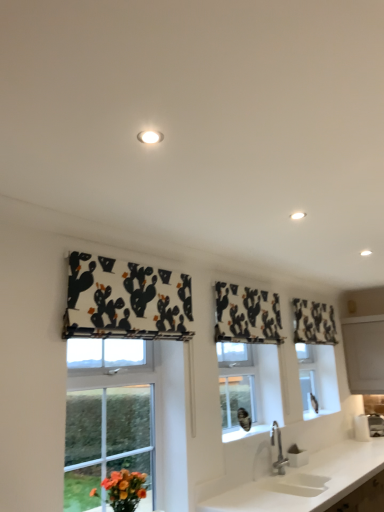
You are a GUI agent. You are given a task and a screenshot of the screen. Output one action in this format:
    pyautogui.click(x=<x>, y=<y>)
    Task: Click on the vacant area situated below black printed fabric at upper center, acting as the third curtain starting from the left (from a real-world perspective)
    The image size is (384, 512).
    Given the screenshot: What is the action you would take?
    pyautogui.click(x=339, y=444)